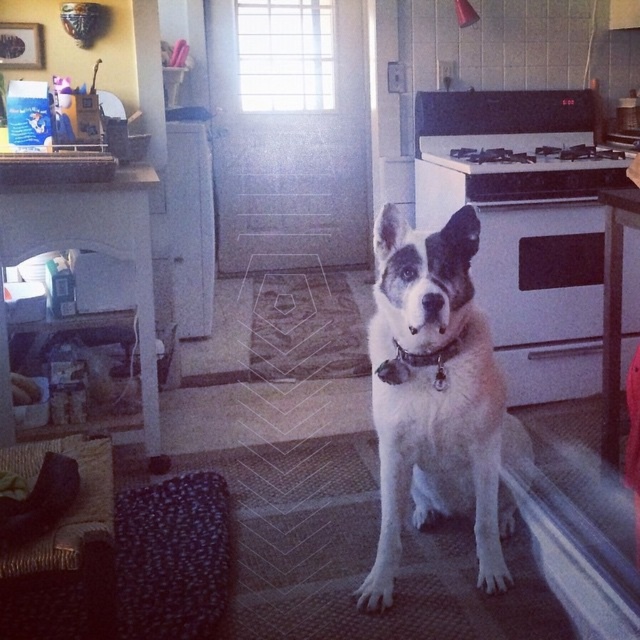
You are a delivery person with a package that requires a clear path to the front door. The transparent glass screen door at center is the entrance. There is a matte black exhaust hood at upper center nearby. Considering their distance, can you walk straight to the screen door without any obstruction?

The transparent glass screen door at center and matte black exhaust hood at upper center are 2.08 meters apart, so there is enough space to walk straight to the screen door without obstruction.

You are a chef trying to reach the matte black exhaust hood at upper center to clean it. There is a white glossy oven at center right in the way. Can you move around the oven to access the hood?

The white glossy oven at center right is in front of the matte black exhaust hood at upper center, so you would need to move the oven or find another path around it to access the hood for cleaning.